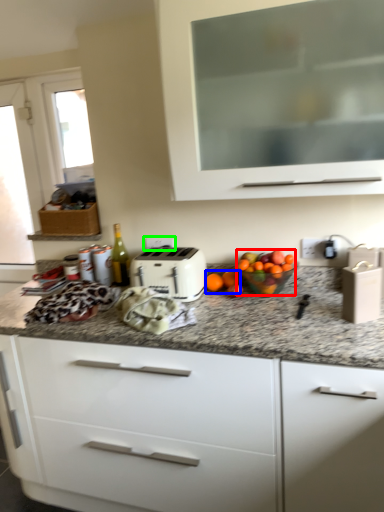
Question: Estimate the real-world distances between objects in this image. Which object is farther from fruit (highlighted by a red box), citrus fruit (highlighted by a blue box) or electric outlet (highlighted by a green box)?

Choices:
 (A) citrus fruit
 (B) electric outlet

Answer: (B)